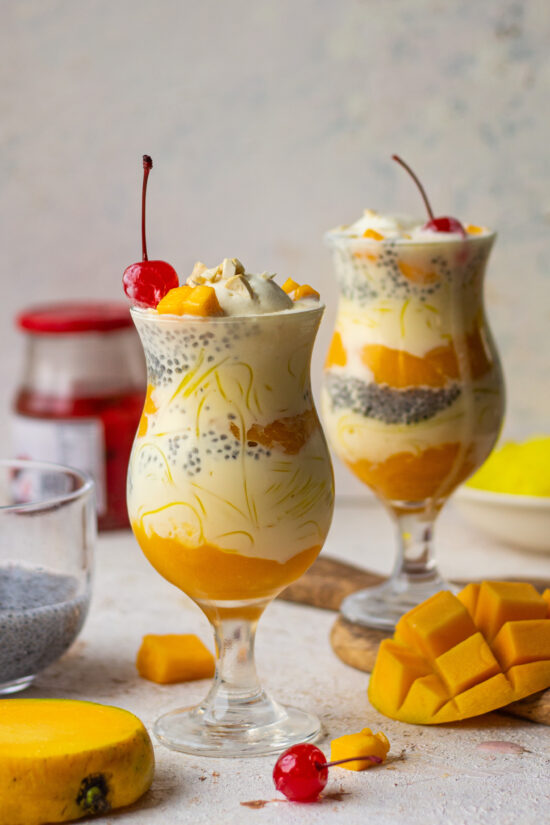
This screenshot has width=550, height=825. I want to click on bowl, so click(510, 498).